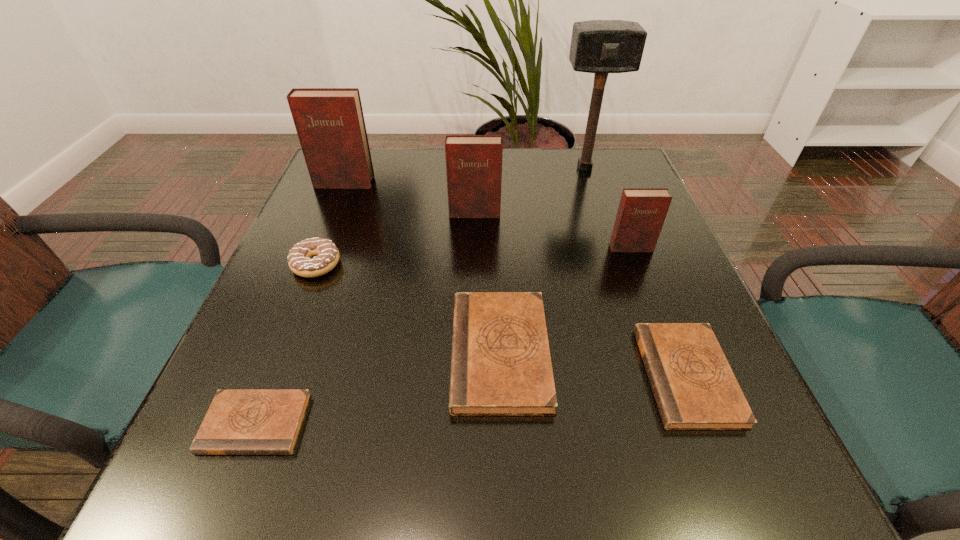
You are a GUI agent. You are given a task and a screenshot of the screen. Output one action in this format:
    pyautogui.click(x=<x>, y=<y>)
    Task: Click on the free space between the shortest diary and the third farthest diary
    
    Given the screenshot: What is the action you would take?
    pyautogui.click(x=444, y=335)

You are a GUI agent. You are given a task and a screenshot of the screen. Output one action in this format:
    pyautogui.click(x=<x>, y=<y>)
    Task: Click on the object that is the fourth closest one to the shortest object
    The image size is (960, 540).
    Given the screenshot: What is the action you would take?
    pyautogui.click(x=694, y=386)

Locate which object ranks seventh in proximity to the chocolate doughnut. Please provide its 2D coordinates. Your answer should be formatted as a tuple, i.e. [(x, y)], where the tuple contains the x and y coordinates of a point satisfying the conditions above.

[(597, 46)]

I want to click on the second closest diary to the biggest reddish-brown diary, so click(501, 365).

Locate an element on the screen. The image size is (960, 540). the closest diary to the chocolate doughnut is located at coordinates (330, 124).

Find the location of a particular element. This screenshot has width=960, height=540. reddish-brown diary that is the closest to the nearest reddish-brown diary is located at coordinates (473, 162).

Locate which reddish-brown diary ranks second in proximity to the biggest reddish-brown diary. Please provide its 2D coordinates. Your answer should be formatted as a tuple, i.e. [(x, y)], where the tuple contains the x and y coordinates of a point satisfying the conditions above.

[(641, 213)]

Locate an element on the screen. This screenshot has width=960, height=540. brown diary that can be found as the second closest to the second reddish-brown diary from left to right is located at coordinates click(x=694, y=386).

Identify the location of brown diary that stands as the closest to the rightmost reddish-brown diary. (694, 386).

Identify the location of blank space that satisfies the following two spatial constraints: 1. on the front cover of the fifth tallest object; 2. on the left side of the tallest diary. The height and width of the screenshot is (540, 960). (311, 265).